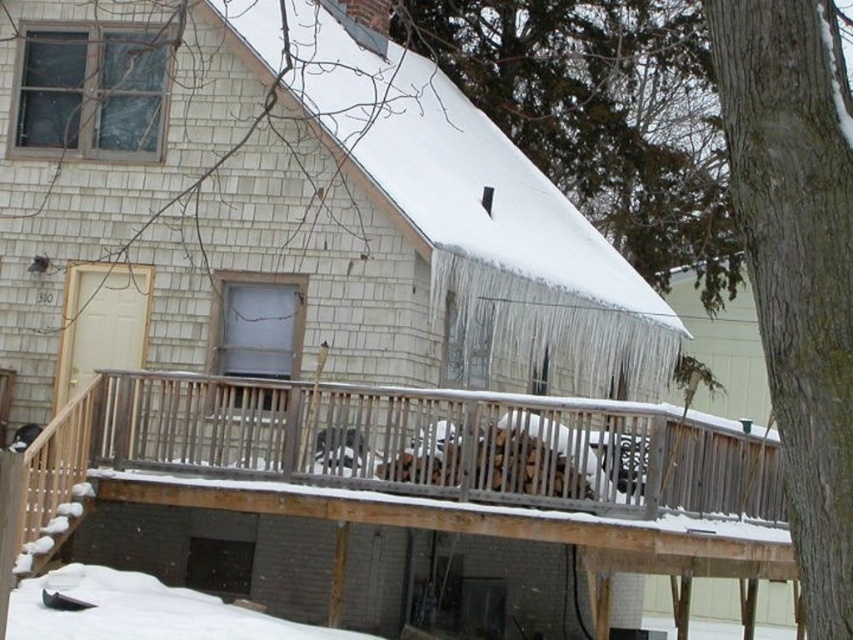
Does smooth gray bark at right have a larger size compared to white fluffy snow at lower left?

Actually, smooth gray bark at right might be smaller than white fluffy snow at lower left.

Find the location of a particular element. smooth gray bark at right is located at coordinates (798, 262).

Is point (358, 394) closer to camera compared to point (128, 620)?

No, (358, 394) is behind (128, 620).

Who is lower down, wooden deck at center or white fluffy snow at lower left?

white fluffy snow at lower left is lower down.

The width and height of the screenshot is (853, 640). Identify the location of wooden deck at center. (407, 445).

The height and width of the screenshot is (640, 853). What are the coordinates of `wooden deck at center` in the screenshot? It's located at (407, 445).

Who is more distant from viewer, (469, 429) or (753, 81)?

The point (469, 429) is behind.

Does wooden deck at center have a greater height compared to smooth gray bark at right?

Incorrect, wooden deck at center's height is not larger of smooth gray bark at right's.

At what (x,y) coordinates should I click in order to perform the action: click on wooden deck at center. Please return your answer as a coordinate pair (x, y). The image size is (853, 640). Looking at the image, I should click on (407, 445).